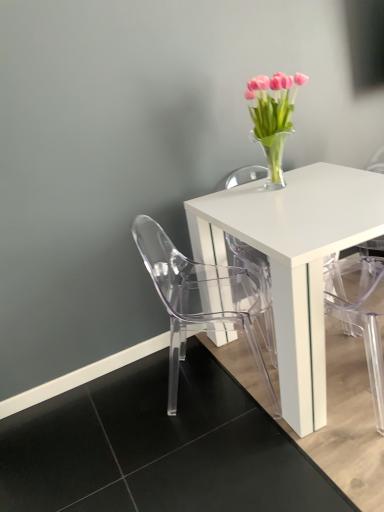
Locate an element on the screen. Image resolution: width=384 pixels, height=512 pixels. empty space that is in between white glossy table at center and transparent plastic chair at lower left is located at coordinates (222, 387).